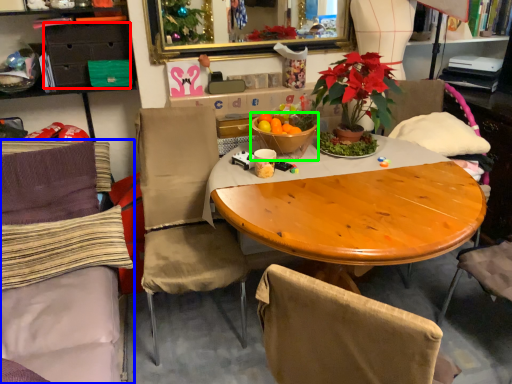
Question: Which is nearer to the drawer (highlighted by a red box)? chair (highlighted by a blue box) or tableware (highlighted by a green box).

Choices:
 (A) chair
 (B) tableware

Answer: (A)